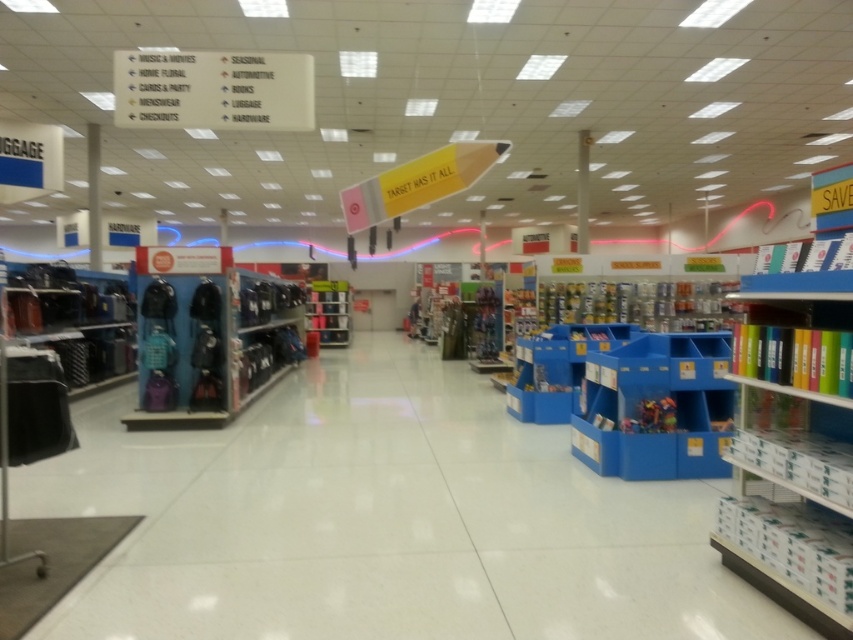
Does blue plastic bin at center have a greater height compared to metallic silver shelf at center?

No, blue plastic bin at center is not taller than metallic silver shelf at center.

What do you see at coordinates (656, 408) in the screenshot?
I see `blue plastic bin at center` at bounding box center [656, 408].

In order to click on blue plastic bin at center in this screenshot , I will do `click(656, 408)`.

Which is in front, point (227, 273) or point (332, 282)?

Point (227, 273)

Is point (165, 323) positioned after point (344, 337)?

That is False.

Find the location of a particular element. Image resolution: width=853 pixels, height=640 pixels. matte black backpacks at center is located at coordinates (207, 337).

Can you confirm if blue plastic bin at center is bigger than matte black luggage at left?

No.

Is blue plastic bin at center taller than matte black luggage at left?

No.

Is point (654, 380) closer to viewer compared to point (125, 307)?

Yes, it is.

In order to click on blue plastic bin at center in this screenshot , I will do `click(656, 408)`.